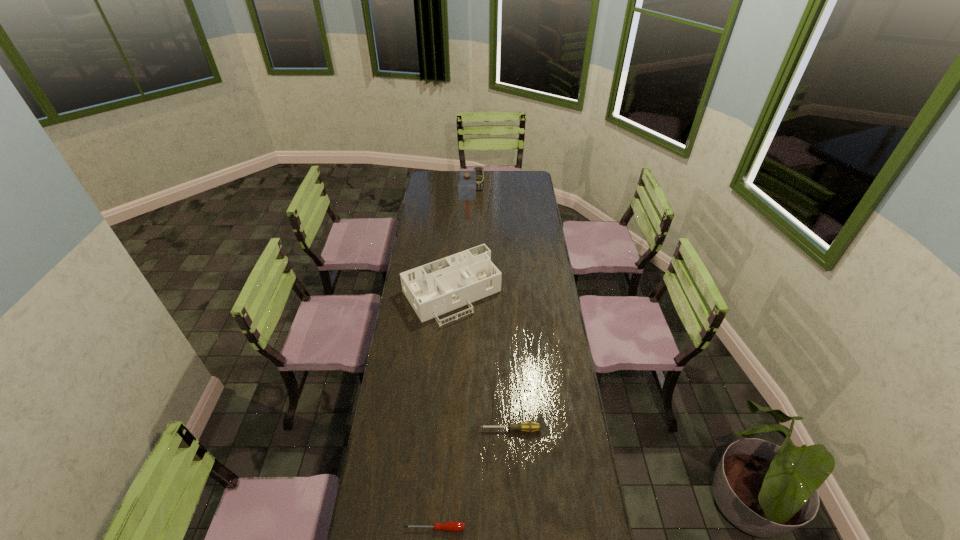
The width and height of the screenshot is (960, 540). Identify the location of blank region between the farther screwdriver and the farthest object. (494, 310).

Identify which object is the fourth nearest to the dollhouse. Please provide its 2D coordinates. Your answer should be formatted as a tuple, i.e. [(x, y)], where the tuple contains the x and y coordinates of a point satisfying the conditions above.

[(455, 526)]

Find the location of `the third closest object to the shorter screwdriver`. the third closest object to the shorter screwdriver is located at coordinates (467, 179).